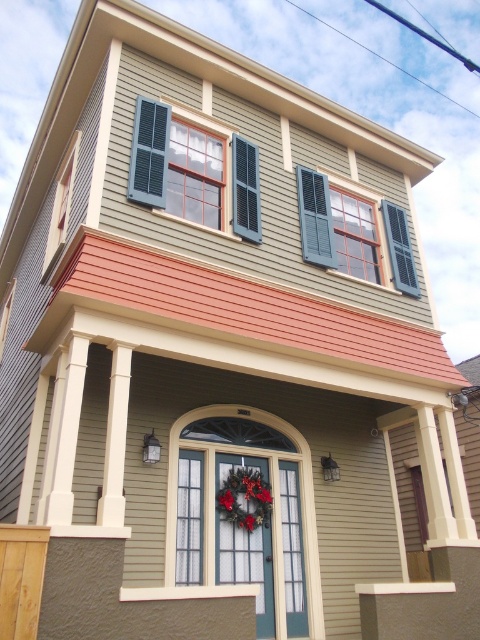
You are a contractor measuring the dimensions of the house for a renovation project. You need to know which object is smaller between the smooth wood porch at center and the matte black shutters at center. Which one is smaller?

The smooth wood porch at center is smaller than the matte black shutters at center according to the description.

Based on the photo, you are standing in front of the house and notice a specific point marked at coordinates (x=229, y=449). What is located at this point?

The smooth wood porch at center is located at point (x=229, y=449).

You are a painter hired to paint the smooth wood porch at center and the matte black shutters at center. Which object requires a taller ladder to reach its top?

The matte black shutters at center are taller than the smooth wood porch at center, so you will need a taller ladder to reach the top of the matte black shutters at center.